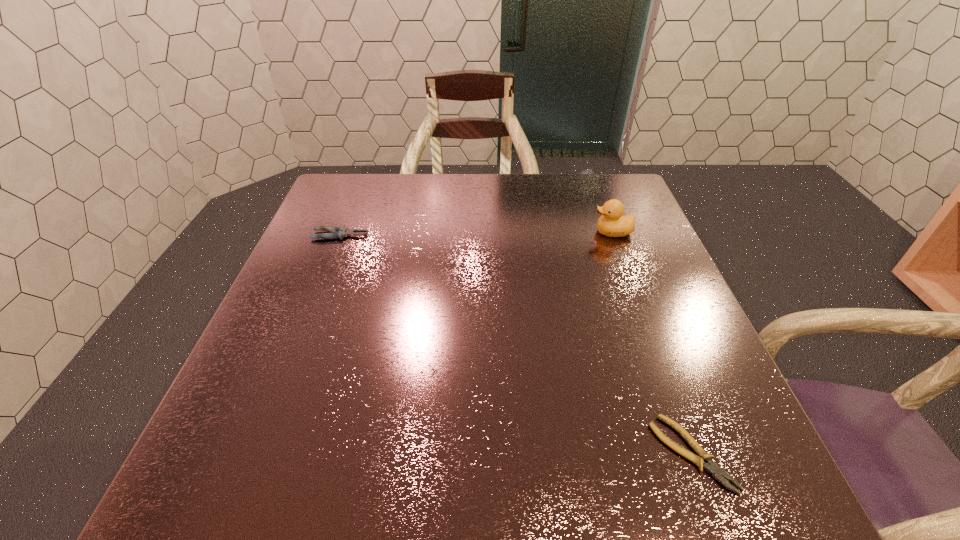
Locate an element on the screen. The width and height of the screenshot is (960, 540). free location that satisfies the following two spatial constraints: 1. facing forward on the tallest object; 2. on the front side of the right pliers is located at coordinates (695, 453).

Identify the location of free location that satisfies the following two spatial constraints: 1. at the gripping part of the shorter pliers; 2. on the left side of the second shortest object. (254, 453).

At what (x,y) coordinates should I click in order to perform the action: click on free location that satisfies the following two spatial constraints: 1. at the gripping part of the left pliers; 2. on the back side of the shorter pliers. Please return your answer as a coordinate pair (x, y). The image size is (960, 540). Looking at the image, I should click on (254, 453).